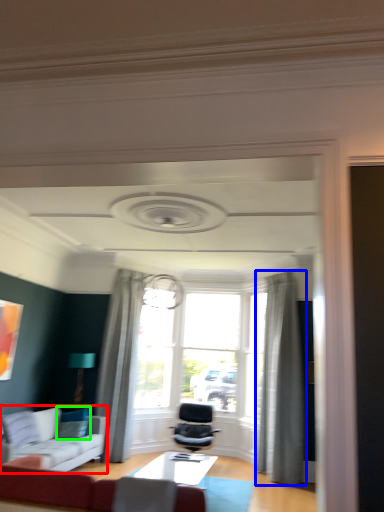
Question: Considering the real-world distances, which object is farthest from studio couch (highlighted by a red box)? curtain (highlighted by a blue box) or pillow (highlighted by a green box)?

Choices:
 (A) curtain
 (B) pillow

Answer: (A)